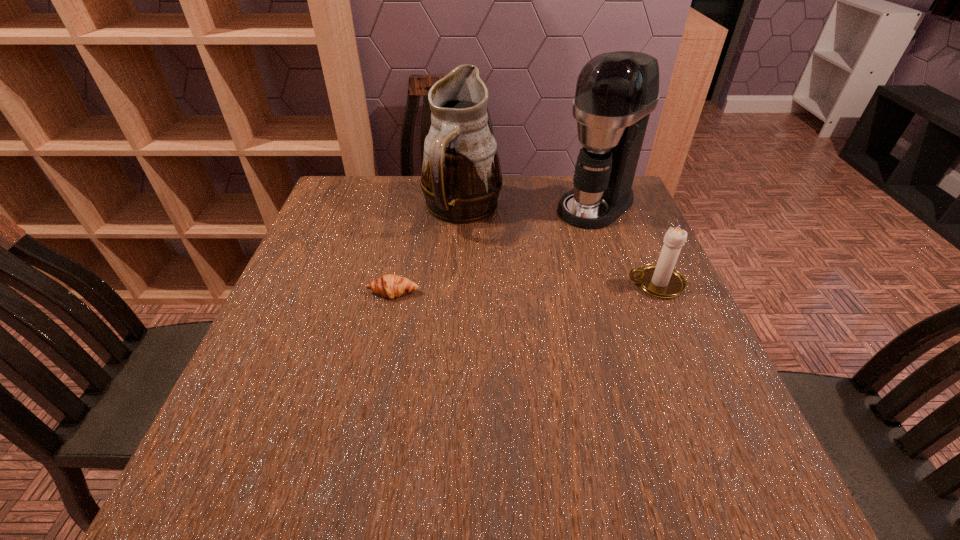
Image resolution: width=960 pixels, height=540 pixels. Identify the location of free area in between the coffee maker and the candle holder. (625, 244).

Locate an element on the screen. Image resolution: width=960 pixels, height=540 pixels. vacant point located between the shortest object and the second shortest object is located at coordinates (524, 288).

Locate an element on the screen. unoccupied position between the pitcher and the candle holder is located at coordinates (559, 247).

The image size is (960, 540). Identify the location of free space between the candle holder and the coffee maker. (625, 244).

The width and height of the screenshot is (960, 540). Find the location of `blank region between the shortest object and the coffee maker`. blank region between the shortest object and the coffee maker is located at coordinates (494, 249).

In order to click on vacant region between the shortest object and the coffee maker in this screenshot , I will do `click(494, 249)`.

This screenshot has height=540, width=960. Find the location of `object that stands as the third closest to the coffee maker`. object that stands as the third closest to the coffee maker is located at coordinates (391, 285).

Where is `object that is the second closest one to the third tallest object`? This screenshot has width=960, height=540. object that is the second closest one to the third tallest object is located at coordinates (461, 178).

Locate an element on the screen. vacant area in the image that satisfies the following two spatial constraints: 1. on the front side of the second shortest object; 2. on the handle side of the pitcher is located at coordinates (458, 284).